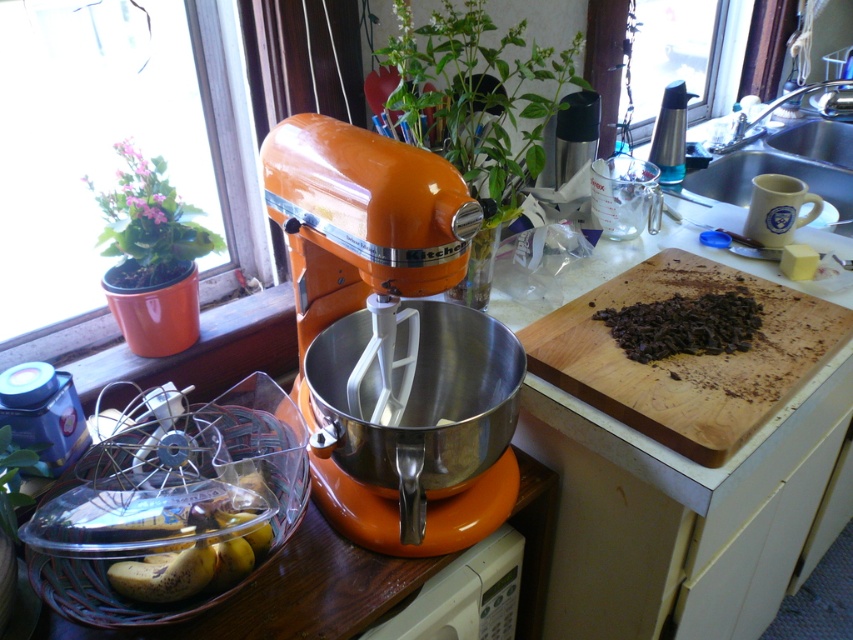
In the scene shown: You are organizing a baking event and need to place the orange glossy kitchenaid mixer at center and the wooden cutting board at right on a narrow shelf. The shelf can only accommodate items that are no wider than 12 inches. Which item should you place first to ensure both fit?

The orange glossy kitchenaid mixer at center is thinner than the wooden cutting board at right, so place the wooden cutting board at right first since it is wider and ensure there is enough space for the thinner mixer afterward.

You are a chef standing in the kitchen and want to reach the orange plastic stand mixer at center. The average arm length of a person is 25 inches. Can you reach it without moving your feet?

The orange plastic stand mixer at center is 35.29 inches away from the viewer. Since the average arm length is 25 inches, the chef cannot reach it without moving closer.